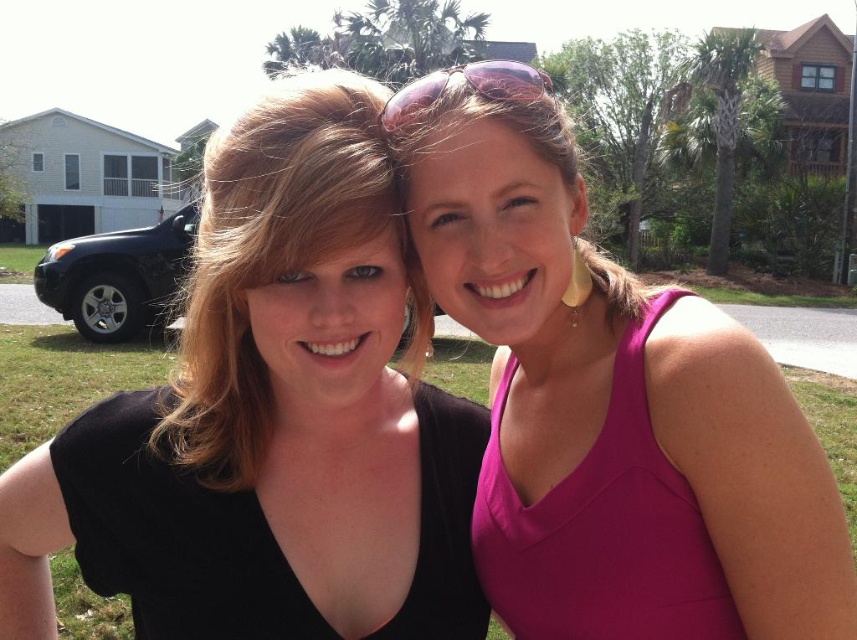
You are an AI analyzing the positions of clothing items in the image. The black matte dress at left is located at coordinates. Is it positioned in the lower half of the image?

The black matte dress at left is located at point (x=172, y=534). Since the y coordinate 0.202 is less than 0.5, it is positioned in the upper half of the image, not the lower half.

You are standing in front of the image and want to locate the pink matte tank top at center. Where exactly is it positioned in terms of coordinates?

The pink matte tank top at center is located at coordinates point [610,384].

You are a photographer taking a picture of two friends. You notice the pink matte tank top at center and the fuchsia fabric tank top at right. Which one is positioned higher in the frame?

The pink matte tank top at center is positioned higher in the frame than the fuchsia fabric tank top at right.